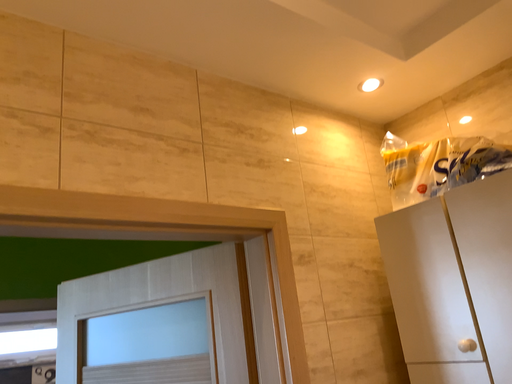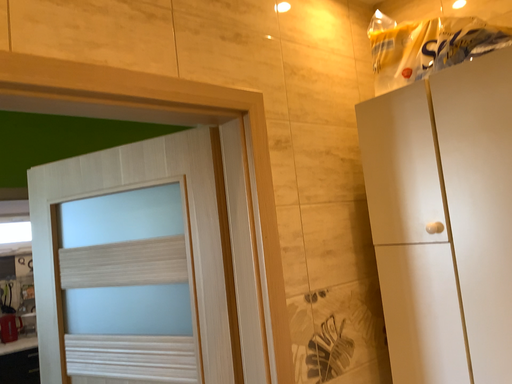
Question: How did the camera likely rotate when shooting the video?

Choices:
 (A) rotated downward
 (B) rotated upward

Answer: (A)